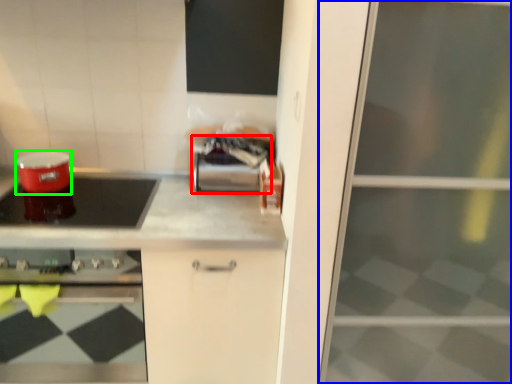
Question: Which object is positioned farthest from appliance (highlighted by a red box)? Select from screen door (highlighted by a blue box) and appliance (highlighted by a green box).

Choices:
 (A) screen door
 (B) appliance

Answer: (A)